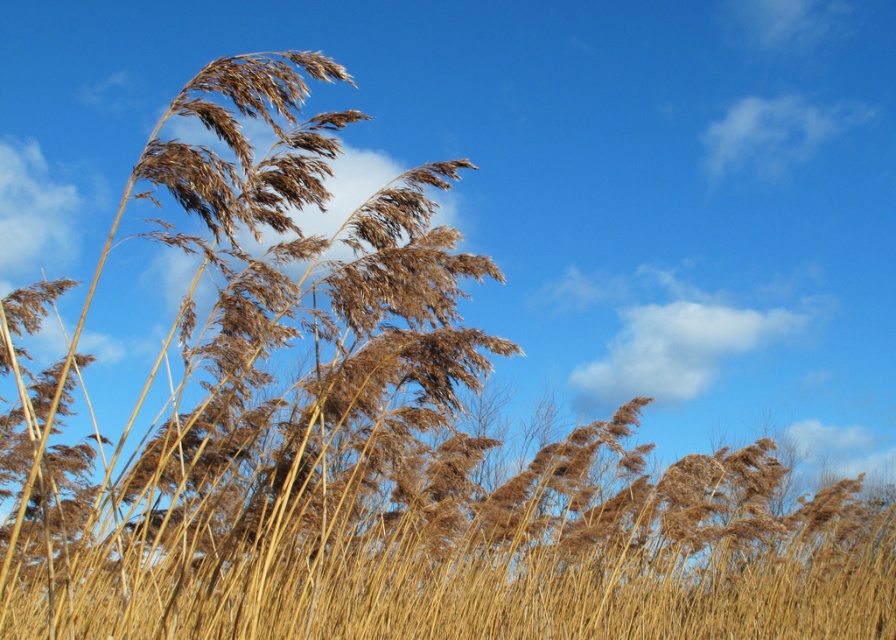
You are standing in a field of tall reeds and want to determine which of the two points, point (662, 316) or point (782, 129), is closer to you. Based on the scene description, which point is nearer?

Point (662, 316) is closer to the viewer than point (782, 129) according to the description.

You are a bird soaring above the reeds and want to land on the nearest cloud. Which cloud would you choose between the white fluffy cloud at upper center and the white fluffy cloud at upper right?

The white fluffy cloud at upper center is smaller in size compared to the white fluffy cloud at upper right. However, since both clouds are in the sky, their actual distance from the bird cannot be determined based solely on their size in the image. The question of which is nearer would require additional information about their altitude or position relative to the observer.

You are an airplane pilot flying at a high altitude and notice two white fluffy clouds in the sky. You see the white fluffy cloud at upper center and the white fluffy cloud at upper right. Which cloud has a smaller mass of water vapor?

The white fluffy cloud at upper center has a smaller mass of water vapor because it is thinner than the white fluffy cloud at upper right.